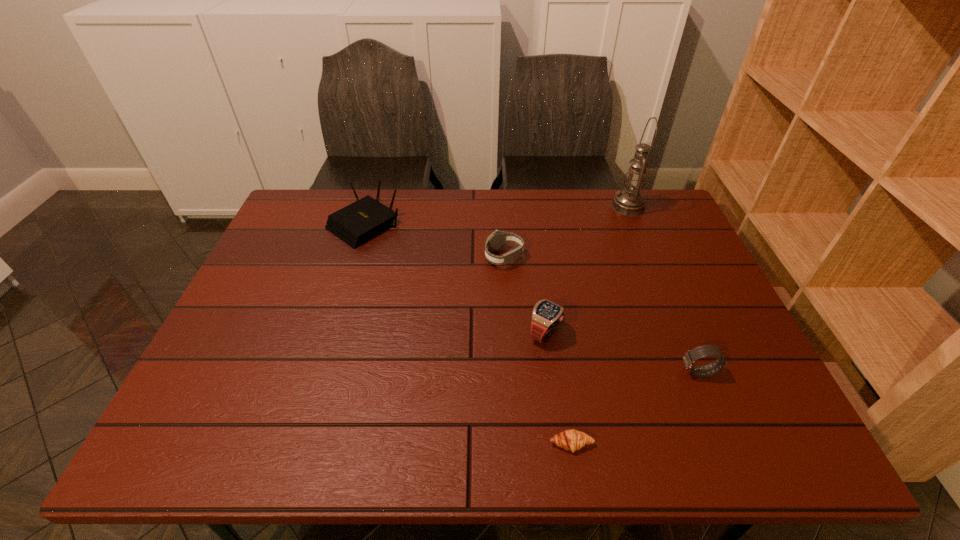
At what (x,y) coordinates should I click in order to perform the action: click on object identified as the third closest to the fourth farthest object. Please return your answer as a coordinate pair (x, y). Image resolution: width=960 pixels, height=540 pixels. Looking at the image, I should click on (689, 358).

At what (x,y) coordinates should I click in order to perform the action: click on object identified as the closest to the pastry. Please return your answer as a coordinate pair (x, y). The height and width of the screenshot is (540, 960). Looking at the image, I should click on (546, 315).

The image size is (960, 540). What are the coordinates of `watch that stands as the second closest to the second farthest watch` in the screenshot? It's located at (689, 358).

Locate which watch is the closest to the tallest object. Please provide its 2D coordinates. Your answer should be formatted as a tuple, i.e. [(x, y)], where the tuple contains the x and y coordinates of a point satisfying the conditions above.

[(496, 240)]

Identify the location of vacant space that satisfies the following two spatial constraints: 1. on the back side of the tallest object; 2. on the right side of the fourth farthest object. pyautogui.click(x=528, y=207).

The image size is (960, 540). I want to click on vacant space that satisfies the following two spatial constraints: 1. on the face of the second farthest watch; 2. on the right side of the farthest watch, so click(509, 333).

In order to click on free location that satisfies the following two spatial constraints: 1. on the face of the farthest watch; 2. on the back side of the second nearest watch in this screenshot , I will do `click(509, 333)`.